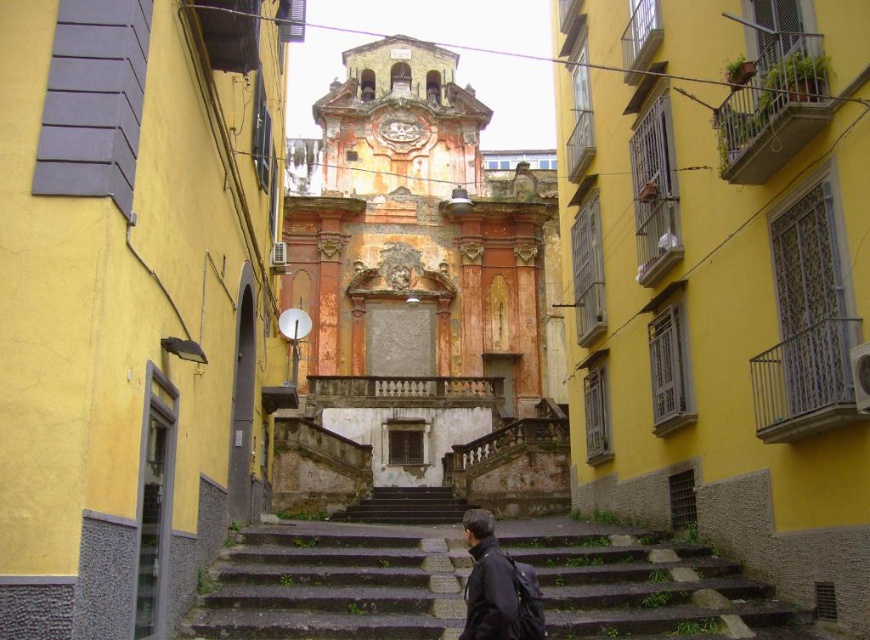
Question: Where is weathered orange church at center located in relation to stone steps at center in the image?

Choices:
 (A) above
 (B) below

Answer: (A)

Question: Which of these objects is positioned closest to the rusty metal church at center?

Choices:
 (A) dark gray concrete stairs at center
 (B) weathered orange church at center
 (C) stone steps at center

Answer: (C)

Question: Which object is farther from the camera taking this photo?

Choices:
 (A) stone steps at center
 (B) rusty metal church at center
 (C) dark matte jacket at lower center
 (D) dark gray concrete stairs at center

Answer: (D)

Question: Is weathered orange church at center below stone steps at center?

Choices:
 (A) no
 (B) yes

Answer: (A)

Question: Estimate the real-world distances between objects in this image. Which object is farther from the rusty metal church at center?

Choices:
 (A) dark matte jacket at lower center
 (B) stone steps at center
 (C) rustic stone church at center
 (D) dark gray concrete stairs at center

Answer: (C)

Question: Is rustic stone church at center bigger than weathered orange church at center?

Choices:
 (A) no
 (B) yes

Answer: (A)